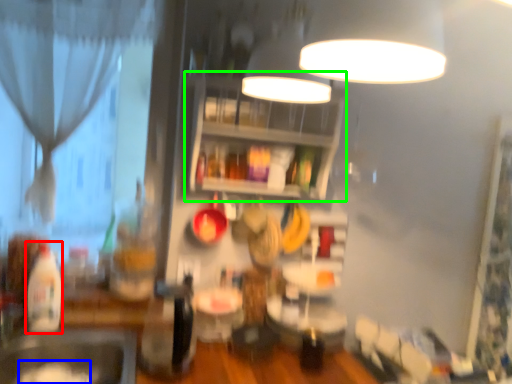
Question: Which object is the closest to the bottle (highlighted by a red box)? Choose among these: food (highlighted by a blue box) or shelf (highlighted by a green box).

Choices:
 (A) food
 (B) shelf

Answer: (A)